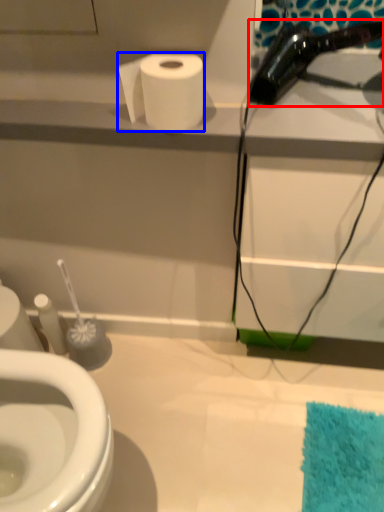
Question: Among these objects, which one is nearest to the camera, hair drier (highlighted by a red box) or toilet paper (highlighted by a blue box)?

Choices:
 (A) hair drier
 (B) toilet paper

Answer: (A)